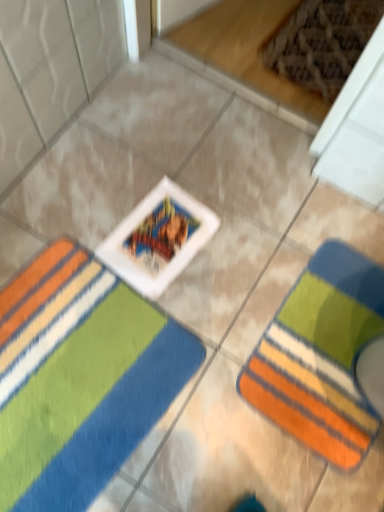
Measure the distance between multicolored striped towel at lower right, which ranks as the first towel in right-to-left order, and camera.

The distance of multicolored striped towel at lower right, which ranks as the first towel in right-to-left order, from camera is 39.33 inches.

Find the location of a particular element. The image size is (384, 512). multicolored striped towel at lower right, which is the second towel from left to right is located at coordinates (321, 356).

This screenshot has height=512, width=384. What do you see at coordinates (321, 356) in the screenshot?
I see `multicolored striped towel at lower right, which ranks as the first towel in right-to-left order` at bounding box center [321, 356].

From the picture: What is the approximate width of multicolored plush towel at center, which is the 1th towel in left-to-right order?

The width of multicolored plush towel at center, which is the 1th towel in left-to-right order, is 20.63 inches.

The width and height of the screenshot is (384, 512). What do you see at coordinates (79, 378) in the screenshot? I see `multicolored plush towel at center, which is the 1th towel in left-to-right order` at bounding box center [79, 378].

The width and height of the screenshot is (384, 512). What are the coordinates of `multicolored plush towel at center, placed as the second towel when sorted from right to left` in the screenshot? It's located at (79, 378).

Locate an element on the screen. The width and height of the screenshot is (384, 512). multicolored striped towel at lower right, which is the second towel from left to right is located at coordinates (321, 356).

Is multicolored plush towel at center, placed as the second towel when sorted from right to left, to the right of multicolored striped towel at lower right, which is the second towel from left to right, from the viewer's perspective?

No.

In the scene shown: Is multicolored plush towel at center, which is the 1th towel in left-to-right order, positioned in front of multicolored striped towel at lower right, which is the second towel from left to right?

Yes, multicolored plush towel at center, which is the 1th towel in left-to-right order, is closer to the viewer.

Which is in front, point (36, 335) or point (288, 418)?

The point (288, 418) is closer.

From the image's perspective, is multicolored plush towel at center, placed as the second towel when sorted from right to left, positioned above or below multicolored striped towel at lower right, which ranks as the first towel in right-to-left order?

multicolored plush towel at center, placed as the second towel when sorted from right to left, is situated lower than multicolored striped towel at lower right, which ranks as the first towel in right-to-left order, in the image.

From a real-world perspective, is multicolored plush towel at center, which is the 1th towel in left-to-right order, on top of multicolored striped towel at lower right, which ranks as the first towel in right-to-left order?

Yes, from a real-world perspective, multicolored plush towel at center, which is the 1th towel in left-to-right order, is on top of multicolored striped towel at lower right, which ranks as the first towel in right-to-left order.

Is multicolored plush towel at center, which is the 1th towel in left-to-right order, thinner than multicolored striped towel at lower right, which ranks as the first towel in right-to-left order?

No, multicolored plush towel at center, which is the 1th towel in left-to-right order, is not thinner than multicolored striped towel at lower right, which ranks as the first towel in right-to-left order.

Based on the photo, who is taller, multicolored plush towel at center, placed as the second towel when sorted from right to left, or multicolored striped towel at lower right, which is the second towel from left to right?

Standing taller between the two is multicolored plush towel at center, placed as the second towel when sorted from right to left.

Can you confirm if multicolored plush towel at center, which is the 1th towel in left-to-right order, is smaller than multicolored striped towel at lower right, which ranks as the first towel in right-to-left order?

Answer: Incorrect, multicolored plush towel at center, which is the 1th towel in left-to-right order, is not smaller in size than multicolored striped towel at lower right, which ranks as the first towel in right-to-left order.

Would you say multicolored plush towel at center, placed as the second towel when sorted from right to left, is inside or outside multicolored striped towel at lower right, which is the second towel from left to right?

multicolored plush towel at center, placed as the second towel when sorted from right to left, is not enclosed by multicolored striped towel at lower right, which is the second towel from left to right.

Is multicolored plush towel at center, placed as the second towel when sorted from right to left, with multicolored striped towel at lower right, which ranks as the first towel in right-to-left order?

No.

Is multicolored plush towel at center, placed as the second towel when sorted from right to left, oriented towards multicolored striped towel at lower right, which is the second towel from left to right?

Yes, multicolored plush towel at center, placed as the second towel when sorted from right to left, is turned towards multicolored striped towel at lower right, which is the second towel from left to right.

At what (x,y) coordinates should I click in order to perform the action: click on towel that appears above the multicolored striped towel at lower right, which ranks as the first towel in right-to-left order (from a real-world perspective). Please return your answer as a coordinate pair (x, y). The image size is (384, 512). Looking at the image, I should click on (79, 378).

Considering the positions of objects multicolored striped towel at lower right, which ranks as the first towel in right-to-left order, and multicolored plush towel at center, placed as the second towel when sorted from right to left, in the image provided, who is more to the left, multicolored striped towel at lower right, which ranks as the first towel in right-to-left order, or multicolored plush towel at center, placed as the second towel when sorted from right to left,?

multicolored plush towel at center, placed as the second towel when sorted from right to left.

Is multicolored striped towel at lower right, which is the second towel from left to right, positioned behind multicolored plush towel at center, placed as the second towel when sorted from right to left?

That is True.

Which point is more distant from viewer, (332, 442) or (63, 477)?

Positioned behind is point (332, 442).

From the image's perspective, which one is positioned lower, multicolored striped towel at lower right, which is the second towel from left to right, or multicolored plush towel at center, placed as the second towel when sorted from right to left?

multicolored plush towel at center, placed as the second towel when sorted from right to left, is shown below in the image.

From a real-world perspective, is multicolored striped towel at lower right, which is the second towel from left to right, below multicolored plush towel at center, which is the 1th towel in left-to-right order?

Indeed, from a real-world perspective, multicolored striped towel at lower right, which is the second towel from left to right, is positioned beneath multicolored plush towel at center, which is the 1th towel in left-to-right order.

In terms of width, does multicolored striped towel at lower right, which ranks as the first towel in right-to-left order, look wider or thinner when compared to multicolored plush towel at center, placed as the second towel when sorted from right to left?

Considering their sizes, multicolored striped towel at lower right, which ranks as the first towel in right-to-left order, looks slimmer than multicolored plush towel at center, placed as the second towel when sorted from right to left.

Which of these two, multicolored striped towel at lower right, which is the second towel from left to right, or multicolored plush towel at center, which is the 1th towel in left-to-right order, stands shorter?

multicolored striped towel at lower right, which is the second towel from left to right.

Which of these two, multicolored striped towel at lower right, which ranks as the first towel in right-to-left order, or multicolored plush towel at center, which is the 1th towel in left-to-right order, is smaller?

multicolored striped towel at lower right, which ranks as the first towel in right-to-left order.

Do you think multicolored striped towel at lower right, which is the second towel from left to right, is within multicolored plush towel at center, placed as the second towel when sorted from right to left, or outside of it?

multicolored striped towel at lower right, which is the second towel from left to right, is outside multicolored plush towel at center, placed as the second towel when sorted from right to left.

Is multicolored striped towel at lower right, which ranks as the first towel in right-to-left order, positioned far away from multicolored plush towel at center, placed as the second towel when sorted from right to left?

No, multicolored striped towel at lower right, which ranks as the first towel in right-to-left order, is in close proximity to multicolored plush towel at center, placed as the second towel when sorted from right to left.

Does multicolored striped towel at lower right, which is the second towel from left to right, turn towards multicolored plush towel at center, which is the 1th towel in left-to-right order?

Yes, multicolored striped towel at lower right, which is the second towel from left to right, is turned towards multicolored plush towel at center, which is the 1th towel in left-to-right order.

What's the angular difference between multicolored striped towel at lower right, which ranks as the first towel in right-to-left order, and multicolored plush towel at center, which is the 1th towel in left-to-right order,'s facing directions?

There is a 177-degree angle between the facing directions of multicolored striped towel at lower right, which ranks as the first towel in right-to-left order, and multicolored plush towel at center, which is the 1th towel in left-to-right order.

Measure the distance between multicolored striped towel at lower right, which is the second towel from left to right, and multicolored plush towel at center, placed as the second towel when sorted from right to left.

14.69 inches.

Identify the location of towel above the multicolored striped towel at lower right, which is the second towel from left to right (from a real-world perspective). The width and height of the screenshot is (384, 512). (79, 378).

Identify the location of towel below the multicolored plush towel at center, which is the 1th towel in left-to-right order (from a real-world perspective). click(321, 356).

The height and width of the screenshot is (512, 384). Identify the location of towel behind the multicolored plush towel at center, placed as the second towel when sorted from right to left. (321, 356).